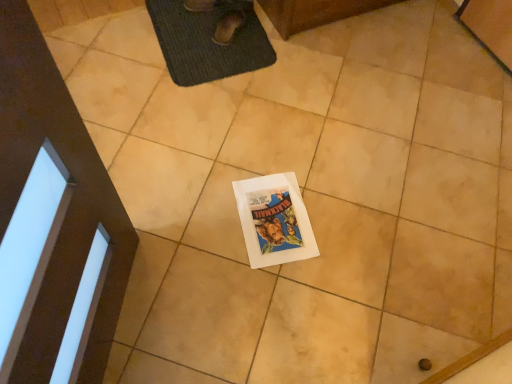
I want to click on free space to the right of brown suede shoe at upper center, so click(x=257, y=35).